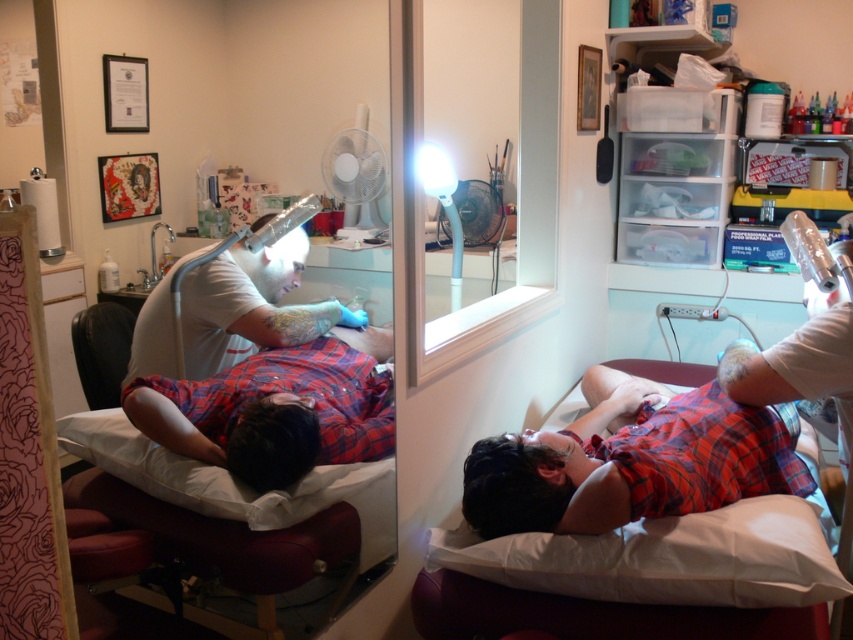
Question: Which of the following is the farthest from the observer?

Choices:
 (A) (270, 502)
 (B) (392, 394)
 (C) (759, 465)
 (D) (268, 278)

Answer: (D)

Question: Can you confirm if white fabric pillow at lower center is positioned below white soft pillow at lower left?

Choices:
 (A) no
 (B) yes

Answer: (B)

Question: Is red plaid shirt at lower center smaller than white soft pillow at lower left?

Choices:
 (A) no
 (B) yes

Answer: (A)

Question: Which point is closer to the camera?

Choices:
 (A) red plaid shirt at lower right
 (B) matte white lamp at upper left

Answer: (A)

Question: Which object is closer to the camera taking this photo?

Choices:
 (A) red plaid shirt at lower right
 (B) matte white lamp at upper left

Answer: (A)

Question: Is matte white lamp at upper left thinner than red plaid shirt at lower right?

Choices:
 (A) no
 (B) yes

Answer: (B)